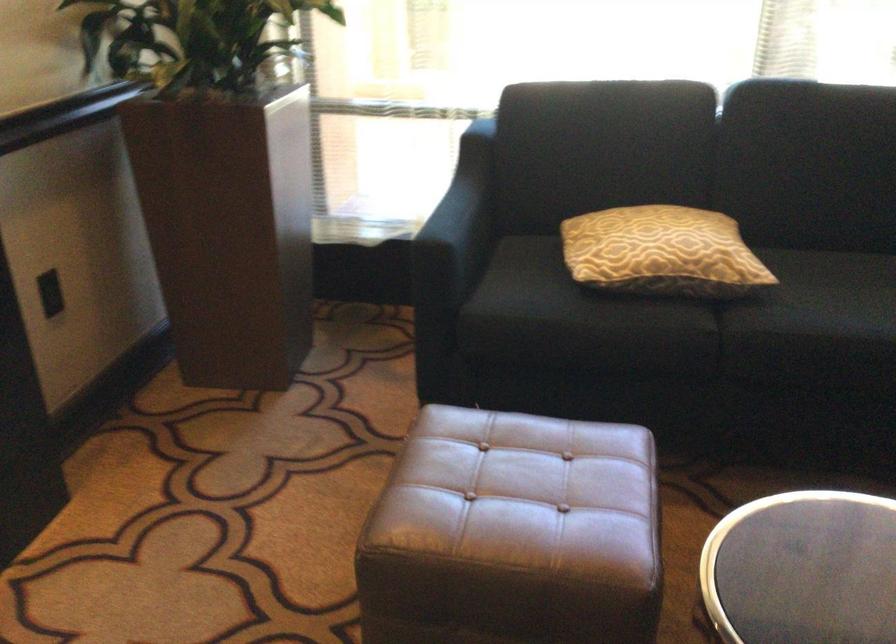
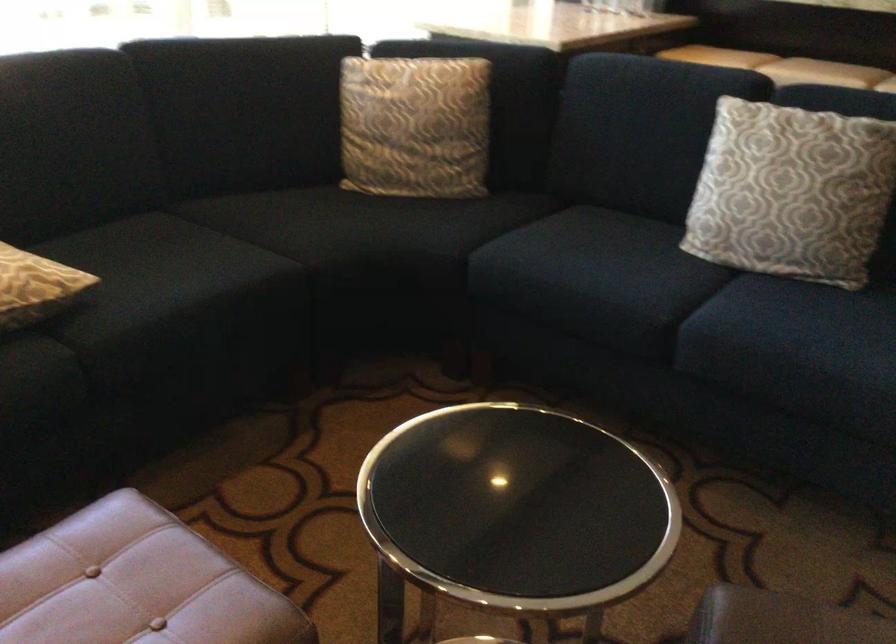
The point at (713, 267) is marked in the first image. Where is the corresponding point in the second image?

(35, 287)